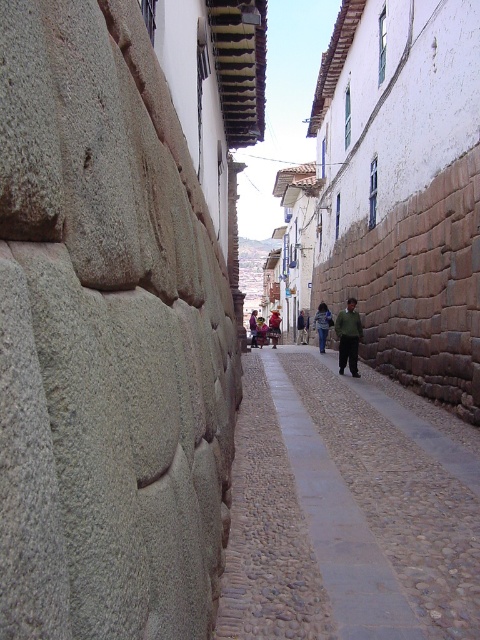
Can you confirm if red fabric dress at center is positioned to the right of reddish-brown leather jacket at center?

Indeed, red fabric dress at center is positioned on the right side of reddish-brown leather jacket at center.

Between red fabric dress at center and reddish-brown leather jacket at center, which one has more height?

Standing taller between the two is red fabric dress at center.

Which is behind, point (277, 321) or point (252, 312)?

The point (252, 312) is behind.

Locate an element on the screen. Image resolution: width=480 pixels, height=640 pixels. red fabric dress at center is located at coordinates (275, 326).

Who is more distant from viewer, [302,317] or [254,321]?

The point [302,317] is more distant.

Between point (302, 326) and point (252, 323), which one is positioned in front?

Positioned in front is point (252, 323).

Describe the element at coordinates (301, 326) in the screenshot. The image size is (480, 640). I see `dark green fabric jacket at center` at that location.

Locate an element on the screen. dark green fabric jacket at center is located at coordinates (301, 326).

Is green fabric jacket at center closer to the viewer compared to reddish-brown leather jacket at center?

Yes, green fabric jacket at center is in front of reddish-brown leather jacket at center.

Does point (339, 337) come in front of point (254, 312)?

Yes, it is.

Image resolution: width=480 pixels, height=640 pixels. I want to click on green fabric jacket at center, so click(x=348, y=337).